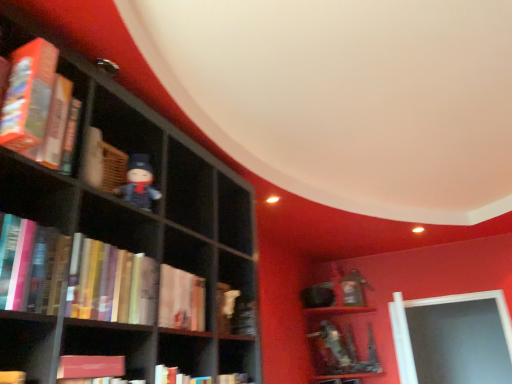
This screenshot has height=384, width=512. Describe the element at coordinates (38, 107) in the screenshot. I see `hardcover book at left, which is the fourth book in bottom-to-top order` at that location.

Describe the element at coordinates (139, 183) in the screenshot. I see `matte black figurine at center-left` at that location.

You are a GUI agent. You are given a task and a screenshot of the screen. Output one action in this format:
    pyautogui.click(x=<x>, y=<y>)
    Task: Click on the matte black figurine at center-left
    
    Given the screenshot: What is the action you would take?
    pyautogui.click(x=139, y=183)

You are a GUI agent. You are given a task and a screenshot of the screen. Output one action in this format:
    pyautogui.click(x=<x>, y=<y>)
    Task: Click on the hardcover book at center, the fourth book when ordered from top to bottom
    The height and width of the screenshot is (384, 512).
    Given the screenshot: What is the action you would take?
    pyautogui.click(x=181, y=300)

Find the location of a particular element. Image resolution: width=512 pixels, height=384 pixels. hardcover book at left, marked as the first book in a top-to-bottom arrangement is located at coordinates (38, 107).

Is hardcover book at left, marked as the first book in a top-to-bottom arrangement, not within hardcover books at left, the second book ordered from the bottom?

Yes.

How different are the orientations of hardcover book at left, marked as the first book in a top-to-bottom arrangement, and hardcover books at left, the second book ordered from the bottom, in degrees?

The angular difference between hardcover book at left, marked as the first book in a top-to-bottom arrangement, and hardcover books at left, the second book ordered from the bottom, is 1.6 degrees.

Can you see hardcover book at left, marked as the first book in a top-to-bottom arrangement, touching hardcover books at left, the 3th book positioned from the top?

There is a gap between hardcover book at left, marked as the first book in a top-to-bottom arrangement, and hardcover books at left, the 3th book positioned from the top.

Looking at this image, does matte black figurine at center-left have a greater height compared to hardcover book at left, marked as the first book in a top-to-bottom arrangement?

Incorrect, the height of matte black figurine at center-left is not larger of that of hardcover book at left, marked as the first book in a top-to-bottom arrangement.

At what (x,y) coordinates should I click in order to perform the action: click on book lying above the matte black figurine at center-left (from the image's perspective). Please return your answer as a coordinate pair (x, y). This screenshot has height=384, width=512. Looking at the image, I should click on (38, 107).

Looking at this image, can you confirm if matte black figurine at center-left is smaller than hardcover book at left, marked as the first book in a top-to-bottom arrangement?

Indeed, matte black figurine at center-left has a smaller size compared to hardcover book at left, marked as the first book in a top-to-bottom arrangement.

From the image's perspective, is matte black figurine at center-left on top of hardcover book at left, which is the fourth book in bottom-to-top order?

No.

Considering the points (109, 299) and (56, 287), which point is in front, point (109, 299) or point (56, 287)?

The point (56, 287) is more forward.

Who is smaller, hardcover books at left, the second book ordered from the bottom, or hardcover book at left, which is the third book from bottom to top?

hardcover book at left, which is the third book from bottom to top.

Is hardcover books at left, the second book ordered from the bottom, with hardcover book at left, which ranks as the 2th book in top-to-bottom order?

No.

Considering the sizes of objects hardcover books at left, the 3th book positioned from the top, and hardcover book at left, which is the third book from bottom to top, in the image provided, who is thinner, hardcover books at left, the 3th book positioned from the top, or hardcover book at left, which is the third book from bottom to top,?

hardcover books at left, the 3th book positioned from the top, is thinner.

Can we say hardcover book at left, which ranks as the 2th book in top-to-bottom order, lies outside hardcover books at left, the 3th book positioned from the top?

Yes, hardcover book at left, which ranks as the 2th book in top-to-bottom order, is located beyond the bounds of hardcover books at left, the 3th book positioned from the top.

Which object is closer to the camera taking this photo, hardcover book at left, which is the third book from bottom to top, or hardcover books at left, the second book ordered from the bottom?

hardcover book at left, which is the third book from bottom to top, is in front.

From a real-world perspective, is hardcover book at left, which is the third book from bottom to top, physically below hardcover books at left, the 3th book positioned from the top?

Indeed, from a real-world perspective, hardcover book at left, which is the third book from bottom to top, is positioned beneath hardcover books at left, the 3th book positioned from the top.

Is point (26, 290) more distant than point (113, 320)?

No.

Based on the photo, considering the sizes of objects hardcover book at left, which is the third book from bottom to top, and hardcover book at left, which is the fourth book in bottom-to-top order, in the image provided, who is shorter, hardcover book at left, which is the third book from bottom to top, or hardcover book at left, which is the fourth book in bottom-to-top order,?

With less height is hardcover book at left, which is the third book from bottom to top.

From a real-world perspective, which is physically above, hardcover book at left, which ranks as the 2th book in top-to-bottom order, or hardcover book at left, which is the fourth book in bottom-to-top order?

hardcover book at left, which is the fourth book in bottom-to-top order, from a real-world perspective.

In the scene shown: Is hardcover book at left, which ranks as the 2th book in top-to-bottom order, to the right of hardcover book at left, marked as the first book in a top-to-bottom arrangement, from the viewer's perspective?

Yes, hardcover book at left, which ranks as the 2th book in top-to-bottom order, is to the right of hardcover book at left, marked as the first book in a top-to-bottom arrangement.

Is hardcover book at left, which is the third book from bottom to top, far away from hardcover book at left, which is the fourth book in bottom-to-top order?

No, there isn't a large distance between hardcover book at left, which is the third book from bottom to top, and hardcover book at left, which is the fourth book in bottom-to-top order.

Considering the relative positions of hardcover book at center, the fourth book when ordered from top to bottom, and hardcover book at left, marked as the first book in a top-to-bottom arrangement, in the image provided, is hardcover book at center, the fourth book when ordered from top to bottom, in front of hardcover book at left, marked as the first book in a top-to-bottom arrangement,?

No, it is not.

From a real-world perspective, between hardcover book at center, which is the first book from bottom to top, and hardcover book at left, which is the fourth book in bottom-to-top order, who is vertically lower?

hardcover book at center, which is the first book from bottom to top.

Considering the positions of point (160, 274) and point (45, 122), is point (160, 274) closer or farther from the camera than point (45, 122)?

Clearly, point (160, 274) is more distant from the camera than point (45, 122).

In the image, is hardcover book at center, which is the first book from bottom to top, on the left side or the right side of hardcover book at left, which is the fourth book in bottom-to-top order?

From the image, it's evident that hardcover book at center, which is the first book from bottom to top, is to the right of hardcover book at left, which is the fourth book in bottom-to-top order.

Does matte black figurine at center-left have a greater width compared to hardcover book at center, the fourth book when ordered from top to bottom?

No, matte black figurine at center-left is not wider than hardcover book at center, the fourth book when ordered from top to bottom.

Is matte black figurine at center-left completely or partially outside of hardcover book at center, which is the first book from bottom to top?

Absolutely, matte black figurine at center-left is external to hardcover book at center, which is the first book from bottom to top.

Between matte black figurine at center-left and hardcover book at center, which is the first book from bottom to top, which one has more height?

Standing taller between the two is matte black figurine at center-left.

From a real-world perspective, which is physically above, matte black figurine at center-left or hardcover book at center, which is the first book from bottom to top?

matte black figurine at center-left.

This screenshot has width=512, height=384. I want to click on book that is the 2nd one when counting upward from the hardcover books at left, the 3th book positioned from the top (from the image's perspective), so click(38, 107).

Find the location of a particular element. toy behind the hardcover book at left, which is the fourth book in bottom-to-top order is located at coordinates (139, 183).

Consider the image. Which object lies further to the anchor point hardcover books at left, the second book ordered from the bottom, hardcover book at left, which ranks as the 2th book in top-to-bottom order, or hardcover book at left, marked as the first book in a top-to-bottom arrangement?

hardcover book at left, marked as the first book in a top-to-bottom arrangement, is further to hardcover books at left, the second book ordered from the bottom.

Estimate the real-world distances between objects in this image. Which object is closer to matte black figurine at center-left, hardcover books at left, the 3th book positioned from the top, or hardcover book at center, which is the first book from bottom to top?

hardcover books at left, the 3th book positioned from the top, is closer to matte black figurine at center-left.

When comparing their distances from hardcover book at left, which is the third book from bottom to top, does hardcover book at left, marked as the first book in a top-to-bottom arrangement, or matte black figurine at center-left seem further?

matte black figurine at center-left is positioned further to the anchor hardcover book at left, which is the third book from bottom to top.

From the image, which object appears to be nearer to matte black figurine at center-left, hardcover book at center, which is the first book from bottom to top, or hardcover books at left, the second book ordered from the bottom?

Based on the image, hardcover books at left, the second book ordered from the bottom, appears to be nearer to matte black figurine at center-left.

Consider the image. Which object lies nearer to the anchor point matte black figurine at center-left, hardcover book at center, the fourth book when ordered from top to bottom, or hardcover book at left, marked as the first book in a top-to-bottom arrangement?

Among the two, hardcover book at center, the fourth book when ordered from top to bottom, is located nearer to matte black figurine at center-left.

Considering their positions, is hardcover book at left, which ranks as the 2th book in top-to-bottom order, positioned closer to hardcover book at left, which is the fourth book in bottom-to-top order, than hardcover book at center, which is the first book from bottom to top?

Among the two, hardcover book at left, which ranks as the 2th book in top-to-bottom order, is located nearer to hardcover book at left, which is the fourth book in bottom-to-top order.

Based on their spatial positions, is hardcover book at left, which is the fourth book in bottom-to-top order, or matte black figurine at center-left closer to hardcover books at left, the second book ordered from the bottom?

Among the two, matte black figurine at center-left is located nearer to hardcover books at left, the second book ordered from the bottom.

Considering their positions, is hardcover book at left, which is the third book from bottom to top, positioned further to hardcover book at left, which is the fourth book in bottom-to-top order, than hardcover books at left, the 3th book positioned from the top?

hardcover books at left, the 3th book positioned from the top, is positioned further to the anchor hardcover book at left, which is the fourth book in bottom-to-top order.

The image size is (512, 384). I want to click on toy between hardcover book at left, which is the fourth book in bottom-to-top order, and hardcover books at left, the second book ordered from the bottom, vertically, so click(x=139, y=183).

Find the location of a particular element. toy between hardcover book at left, marked as the first book in a top-to-bottom arrangement, and hardcover book at center, which is the first book from bottom to top, vertically is located at coordinates (139, 183).

Locate an element on the screen. book between hardcover book at left, marked as the first book in a top-to-bottom arrangement, and hardcover books at left, the 3th book positioned from the top, vertically is located at coordinates (32, 266).